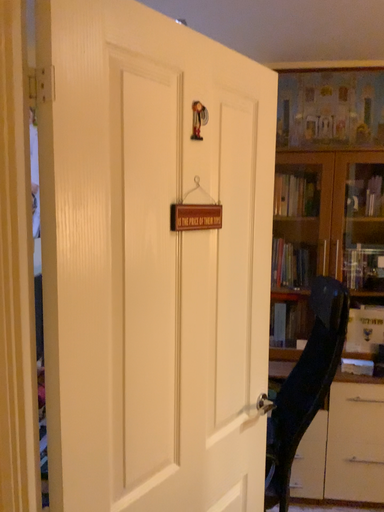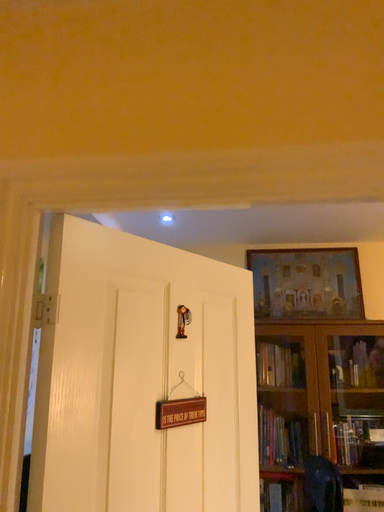
Question: How did the camera likely rotate when shooting the video?

Choices:
 (A) rotated upward
 (B) rotated downward

Answer: (A)